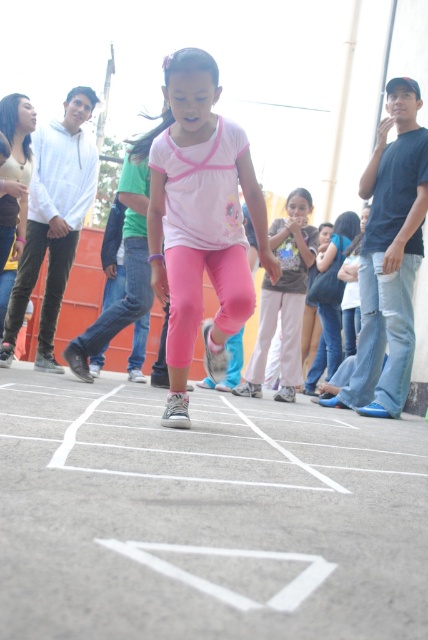
You are standing in the hopscotch area and want to jump over the white painted lines at center without touching them. How much space do you have to avoid stepping on them?

The distance between you and the white painted lines at center is 32.77 inches, so you have enough space to jump over them without touching.

You are organizing a clothing donation drive and need to categorize items by size. You have two pink fabric items in front of you. The first is the pink fabric leggings at upper left, and the second is the pink fabric pants at center. Which item should you place in the larger size bin?

The pink fabric leggings at upper left should be placed in the larger size bin because it has a larger size compared to the pink fabric pants at center.

Where are the white painted lines at center located in the image?

The white painted lines at center are located at point coordinates of (205, 516).